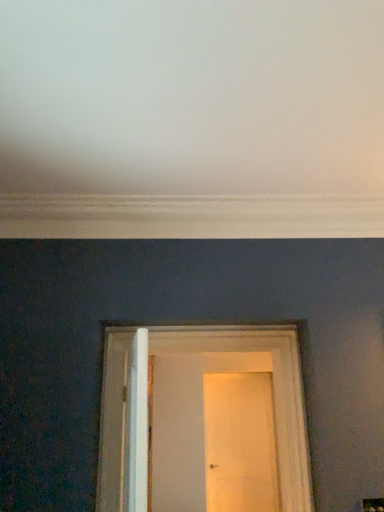
Question: Is white wooden door at center, marked as the second door in a bottom-to-top arrangement, wider or thinner than wooden door at center, placed as the 1th door when sorted from back to front?

Choices:
 (A) wide
 (B) thin

Answer: (A)

Question: In the image, is white wooden door at center, acting as the first door starting from the top, positioned in front of or behind wooden door at center, which is the second door in top-to-bottom order?

Choices:
 (A) behind
 (B) front

Answer: (B)

Question: Considering the positions of point (102, 494) and point (271, 439), is point (102, 494) closer or farther from the camera than point (271, 439)?

Choices:
 (A) farther
 (B) closer

Answer: (B)

Question: From their relative heights in the image, would you say wooden door at center, the second door in the front-to-back sequence, is taller or shorter than white wooden door at center, marked as the second door in a bottom-to-top arrangement?

Choices:
 (A) tall
 (B) short

Answer: (A)

Question: In terms of width, does wooden door at center, placed as the 1th door when sorted from back to front, look wider or thinner when compared to white wooden door at center, marked as the second door in a back-to-front arrangement?

Choices:
 (A) thin
 (B) wide

Answer: (A)

Question: Based on their positions, is wooden door at center, arranged as the first door when ordered from the bottom, located to the left or right of white wooden door at center, marked as the second door in a bottom-to-top arrangement?

Choices:
 (A) left
 (B) right

Answer: (B)

Question: Which is correct: wooden door at center, which is the second door in top-to-bottom order, is inside white wooden door at center, marked as the second door in a bottom-to-top arrangement, or outside of it?

Choices:
 (A) outside
 (B) inside

Answer: (A)